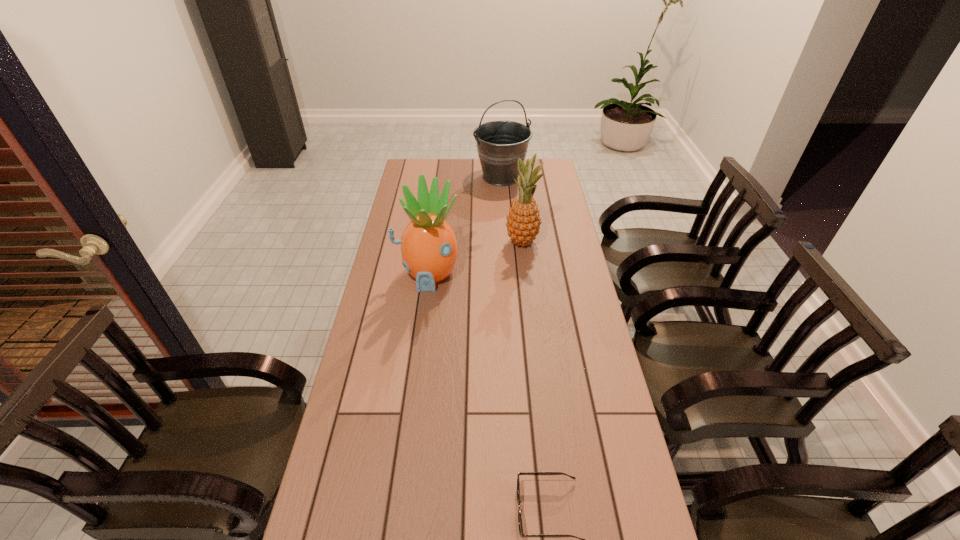
What are the coordinates of `the farthest object` in the screenshot? It's located at (500, 143).

Identify the location of the third nearest object. (523, 223).

You are a GUI agent. You are given a task and a screenshot of the screen. Output one action in this format:
    pyautogui.click(x=<x>, y=<y>)
    Task: Click on the right pineapple
    
    Given the screenshot: What is the action you would take?
    pyautogui.click(x=523, y=223)

Locate an element on the screen. The image size is (960, 540). the leftmost object is located at coordinates (429, 249).

Find the location of a particular element. The width and height of the screenshot is (960, 540). the nearer pineapple is located at coordinates (429, 249).

At what (x,y) coordinates should I click in order to perform the action: click on blank area located 0.060m on the left of the farthest object. Please return your answer as a coordinate pair (x, y). The image size is (960, 540). Looking at the image, I should click on (461, 177).

Locate an element on the screen. The width and height of the screenshot is (960, 540). vacant space located 0.150m on the left of the farther pineapple is located at coordinates (466, 242).

I want to click on vacant area situated at the entrance of the nearer pineapple, so click(x=422, y=313).

Where is `object at the far edge`? The width and height of the screenshot is (960, 540). object at the far edge is located at coordinates (500, 143).

Image resolution: width=960 pixels, height=540 pixels. Find the location of `object present at the left edge`. object present at the left edge is located at coordinates tap(429, 249).